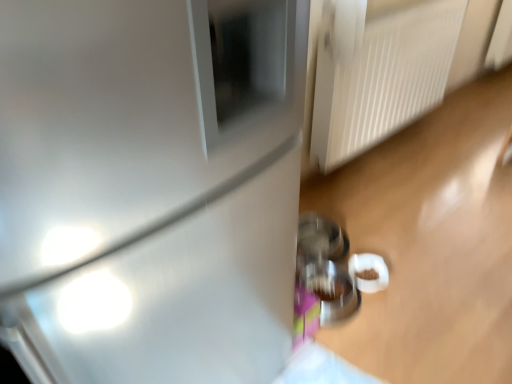
What do you see at coordinates (382, 79) in the screenshot?
I see `white ribbed radiator at upper right` at bounding box center [382, 79].

In the scene shown: What is the approximate width of white ribbed radiator at upper right?

3.27 inches.

At what (x,y) coordinates should I click in order to perform the action: click on white ribbed radiator at upper right. Please return your answer as a coordinate pair (x, y). Looking at the image, I should click on (382, 79).

Identify the location of white ribbed radiator at upper right. (382, 79).